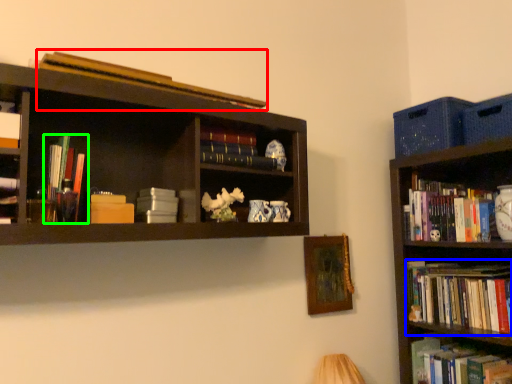
Question: Considering the real-world distances, which object is closest to book (highlighted by a red box)? book (highlighted by a blue box) or book (highlighted by a green box).

Choices:
 (A) book
 (B) book

Answer: (B)